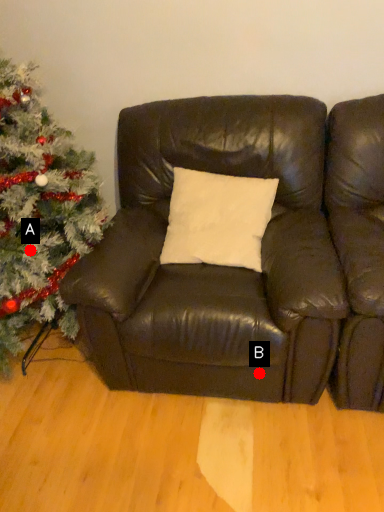
Question: Two points are circled on the image, labeled by A and B beside each circle. Among these points, which one is farthest from the camera?

Choices:
 (A) A is further
 (B) B is further

Answer: (B)